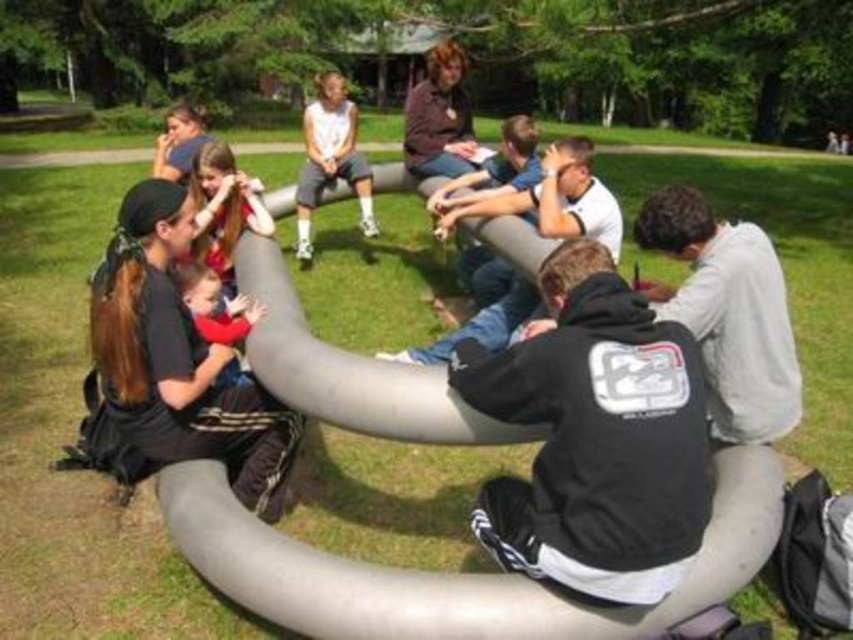
You are a photographer planning to take a group photo of the people at the event. You notice the black matte shirt at lower left and the gray matte jacket at lower right. Which clothing item should you position closer to the camera to ensure both are visible in the frame?

The black matte shirt at lower left has a greater height compared to the gray matte jacket at lower right, so positioning the black matte shirt at lower left closer to the camera will help ensure both are visible in the frame since it is taller and can be placed where it won

You are standing at the origin point in the image. Where is the black fleece jacket at center located in terms of coordinates?

The black fleece jacket at center is located at coordinates point (595, 436).